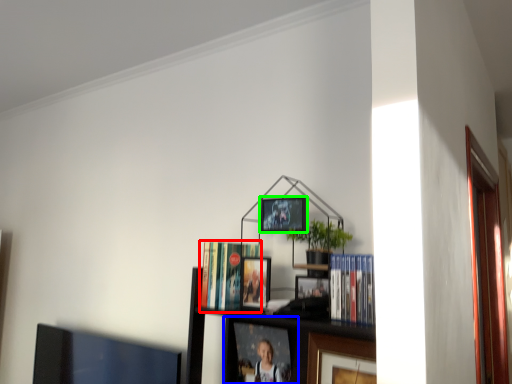
Question: Which object is positioned closest to book (highlighted by a red box)? Select from picture frame (highlighted by a blue box) and picture frame (highlighted by a green box).

Choices:
 (A) picture frame
 (B) picture frame

Answer: (B)